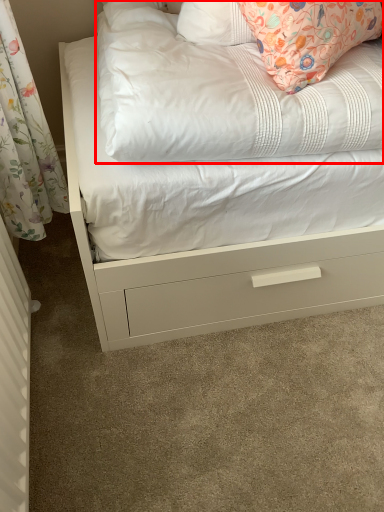
Question: From the image, what is the correct spatial relationship of mattress (annotated by the red box) in relation to radiator?

Choices:
 (A) left
 (B) right

Answer: (B)